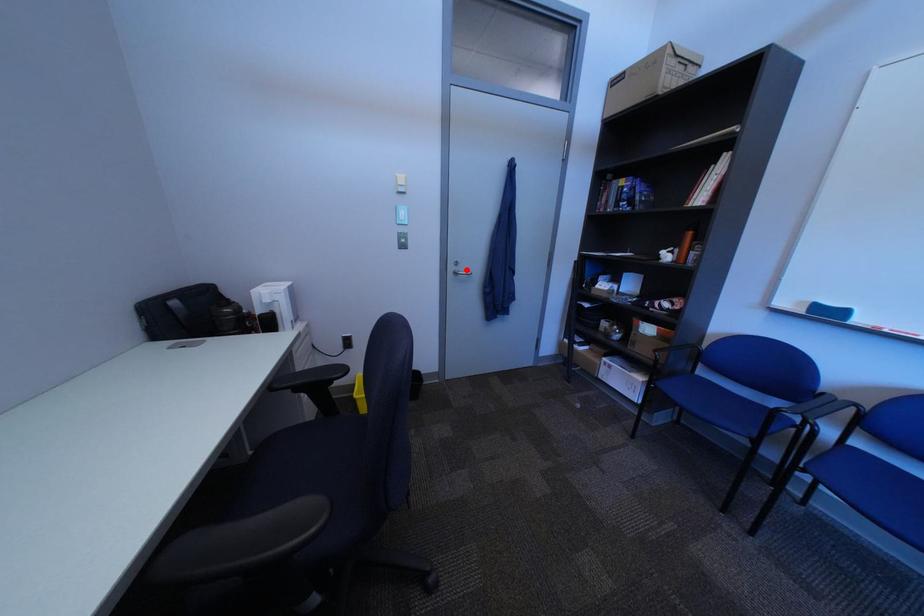
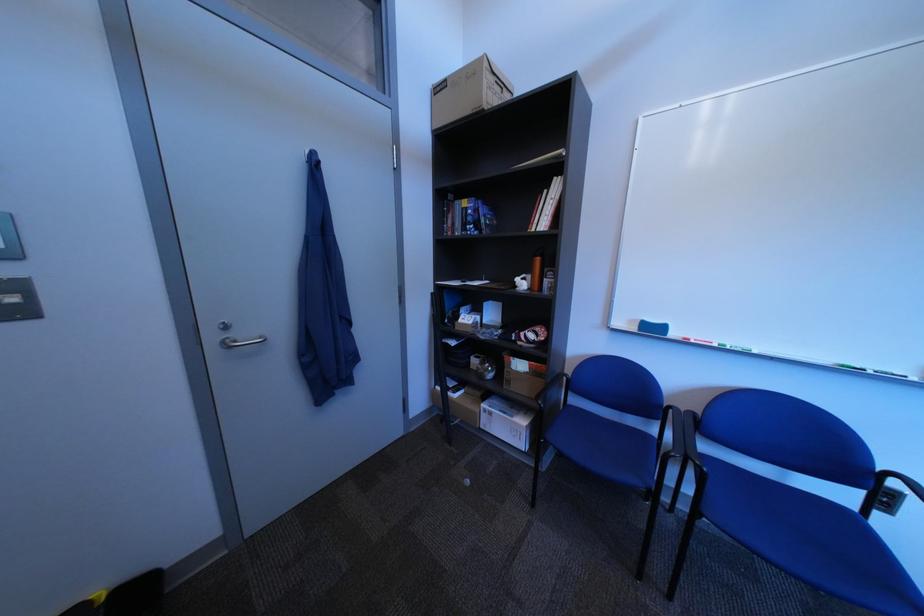
Find the pixel in the second image that matches the highlighted location in the first image.

(226, 339)